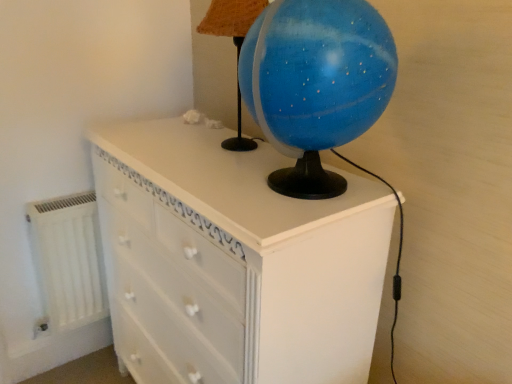
Find the location of a particular element. free space in front of blue glossy globe at upper center is located at coordinates (200, 165).